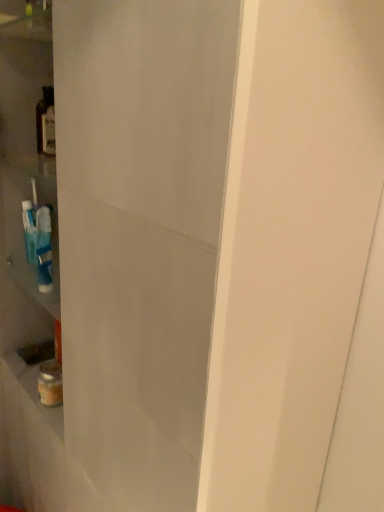
Measure the distance between translucent glass bottle at left and camera.

They are 3.79 feet apart.

Describe the element at coordinates (46, 123) in the screenshot. I see `translucent glass bottle at left` at that location.

Where is `translucent glass bottle at left`? The width and height of the screenshot is (384, 512). translucent glass bottle at left is located at coordinates 46,123.

This screenshot has width=384, height=512. What do you see at coordinates (140, 233) in the screenshot?
I see `transparent glass door at center` at bounding box center [140, 233].

You are a GUI agent. You are given a task and a screenshot of the screen. Output one action in this format:
    pyautogui.click(x=<x>, y=<y>)
    Task: Click on the transparent glass door at center
    
    Given the screenshot: What is the action you would take?
    pyautogui.click(x=140, y=233)

Where is `translucent glass bottle at left`? Image resolution: width=384 pixels, height=512 pixels. translucent glass bottle at left is located at coordinates (46, 123).

Can you confirm if translucent glass bottle at left is positioned to the left of transparent glass door at center?

Yes, translucent glass bottle at left is to the left of transparent glass door at center.

Which object is closer to the camera taking this photo, translucent glass bottle at left or transparent glass door at center?

transparent glass door at center is in front.

Which point is more forward, (36, 125) or (128, 180)?

Point (128, 180)

From the image's perspective, is translucent glass bottle at left above or below transparent glass door at center?

translucent glass bottle at left is above transparent glass door at center.

From a real-world perspective, is translucent glass bottle at left physically above transparent glass door at center?

Correct, in the physical world, translucent glass bottle at left is higher than transparent glass door at center.

Between translucent glass bottle at left and transparent glass door at center, which one has larger width?

Wider between the two is transparent glass door at center.

Who is shorter, translucent glass bottle at left or transparent glass door at center?

translucent glass bottle at left.

Between translucent glass bottle at left and transparent glass door at center, which one has smaller size?

translucent glass bottle at left.

Based on the photo, is transparent glass door at center a part of translucent glass bottle at left?

Definitely not — transparent glass door at center is not inside translucent glass bottle at left.

Based on the photo, is translucent glass bottle at left placed right next to transparent glass door at center?

No, translucent glass bottle at left is not touching transparent glass door at center.

Is transparent glass door at center at the back of translucent glass bottle at left?

Yes, translucent glass bottle at left's orientation is away from transparent glass door at center.

What's the angular difference between translucent glass bottle at left and transparent glass door at center's facing directions?

They differ by 0.00167 degrees in their facing directions.

The image size is (384, 512). Find the location of `bottle that appears above the transparent glass door at center (from the image's perspective)`. bottle that appears above the transparent glass door at center (from the image's perspective) is located at coordinates (46, 123).

Considering the positions of objects transparent glass door at center and translucent glass bottle at left in the image provided, who is more to the right, transparent glass door at center or translucent glass bottle at left?

From the viewer's perspective, transparent glass door at center appears more on the right side.

Relative to translucent glass bottle at left, is transparent glass door at center in front or behind?

transparent glass door at center is in front of translucent glass bottle at left.

Is point (91, 179) in front of point (43, 120)?

Yes, point (91, 179) is closer to viewer.

From the image's perspective, between transparent glass door at center and translucent glass bottle at left, which one is located above?

translucent glass bottle at left.

From a real-world perspective, does transparent glass door at center stand above translucent glass bottle at left?

Incorrect, from a real-world perspective, transparent glass door at center is lower than translucent glass bottle at left.

Between transparent glass door at center and translucent glass bottle at left, which one has larger width?

Wider between the two is transparent glass door at center.

Considering the relative sizes of transparent glass door at center and translucent glass bottle at left in the image provided, is transparent glass door at center taller than translucent glass bottle at left?

Indeed, transparent glass door at center has a greater height compared to translucent glass bottle at left.

Does transparent glass door at center have a larger size compared to translucent glass bottle at left?

Correct, transparent glass door at center is larger in size than translucent glass bottle at left.

Could translucent glass bottle at left be considered to be inside transparent glass door at center?

Indeed, translucent glass bottle at left is located within transparent glass door at center.

Is transparent glass door at center not near translucent glass bottle at left?

No, transparent glass door at center is not far from translucent glass bottle at left.

Is transparent glass door at center positioned with its back to translucent glass bottle at left?

Absolutely, transparent glass door at center is directed away from translucent glass bottle at left.

What are the coordinates of `glass door on the right of the translucent glass bottle at left` in the screenshot? It's located at (140, 233).

You are a GUI agent. You are given a task and a screenshot of the screen. Output one action in this format:
    pyautogui.click(x=<x>, y=<y>)
    Task: Click on the glass door lying on the right of translucent glass bottle at left
    
    Given the screenshot: What is the action you would take?
    pyautogui.click(x=140, y=233)

Locate an element on the screen. This screenshot has width=384, height=512. bottle above the transparent glass door at center (from the image's perspective) is located at coordinates (46, 123).